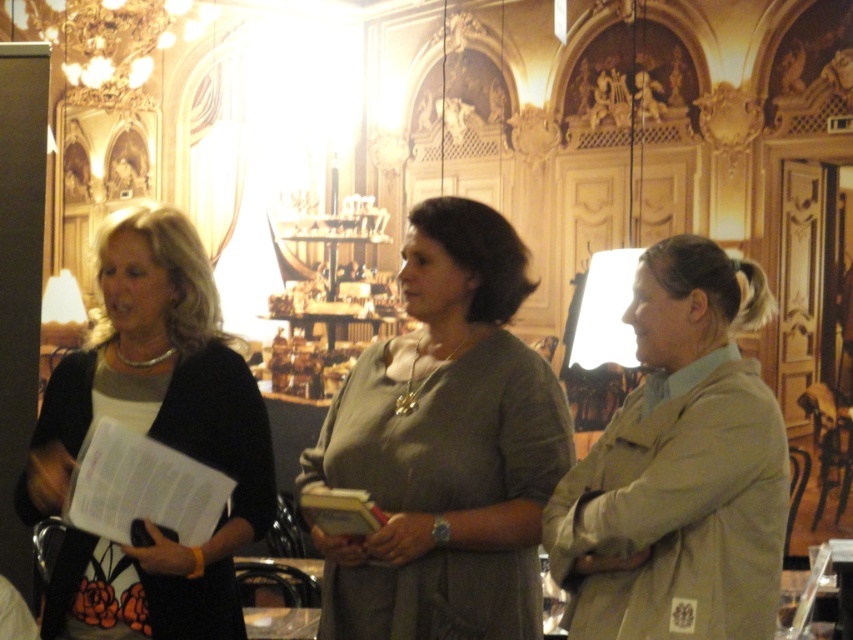
Who is higher up, tan fabric jacket at right or matte black sweater at left?

matte black sweater at left is higher up.

Who is more distant from viewer, (735,628) or (138,582)?

The point (138,582) is more distant.

The width and height of the screenshot is (853, 640). In order to click on tan fabric jacket at right in this screenshot , I will do `click(680, 468)`.

Does point (456, 372) come behind point (585, 568)?

Yes, it is behind point (585, 568).

In the scene shown: Can you confirm if matte olive green blouse at center is shorter than tan fabric jacket at right?

Incorrect, matte olive green blouse at center's height does not fall short of tan fabric jacket at right's.

Image resolution: width=853 pixels, height=640 pixels. Describe the element at coordinates (444, 448) in the screenshot. I see `matte olive green blouse at center` at that location.

Identify the location of matte olive green blouse at center. The width and height of the screenshot is (853, 640). (444, 448).

Does matte olive green blouse at center appear over matte black sweater at left?

Actually, matte olive green blouse at center is below matte black sweater at left.

Locate an element on the screen. The image size is (853, 640). matte olive green blouse at center is located at coordinates (x=444, y=448).

I want to click on matte olive green blouse at center, so click(444, 448).